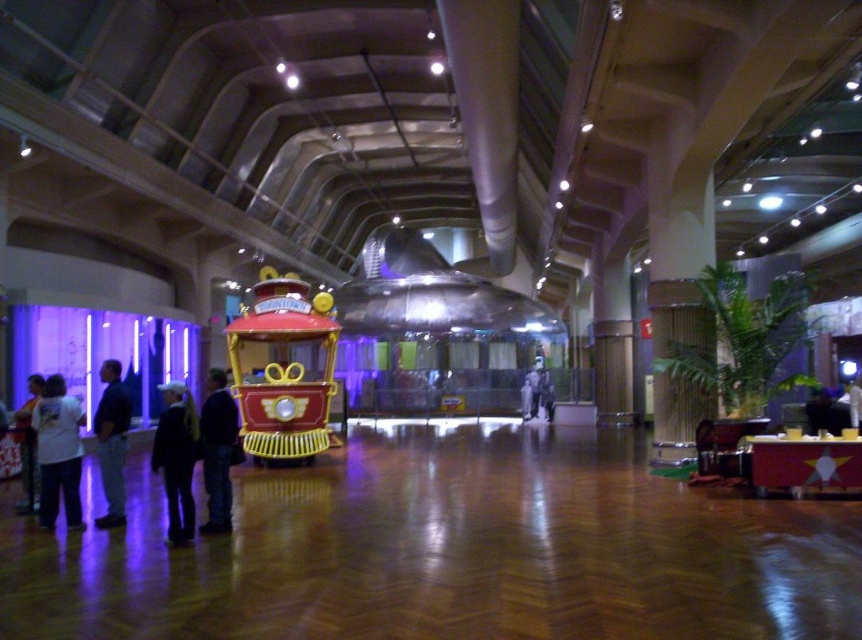
Question: Estimate the real-world distances between objects in this image. Which object is closer to the metallic silver train at center?

Choices:
 (A) white cotton shirt at lower left
 (B) blue denim jeans at center

Answer: (A)

Question: Which is farther from the white cotton shirt at lower left?

Choices:
 (A) white shirt at left
 (B) dark blue jeans at left
 (C) metallic silver train at center
 (D) shiny red train car at center

Answer: (C)

Question: Is metallic silver train at center in front of white cotton shirt at lower left?

Choices:
 (A) yes
 (B) no

Answer: (B)

Question: Among these points, which one is farthest from the camera?

Choices:
 (A) (305, 417)
 (B) (172, 413)

Answer: (A)

Question: Does dark blue jeans at left have a smaller size compared to white shirt at left?

Choices:
 (A) yes
 (B) no

Answer: (A)

Question: Does metallic silver train at center come behind white cotton shirt at lower left?

Choices:
 (A) no
 (B) yes

Answer: (B)